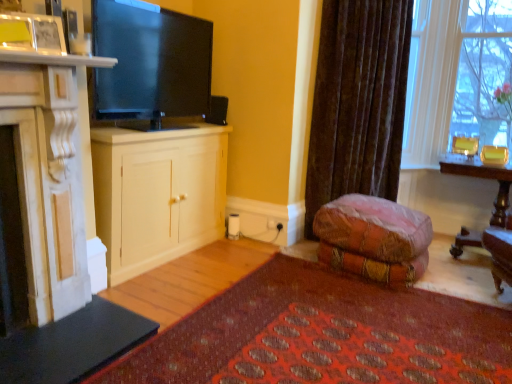
Question: From a real-world perspective, is velvet-like fabric couch at lower center beneath clear glass vase at upper right?

Choices:
 (A) no
 (B) yes

Answer: (B)

Question: Would you consider velvet-like fabric couch at lower center to be distant from clear glass vase at upper right?

Choices:
 (A) no
 (B) yes

Answer: (B)

Question: From a real-world perspective, is velvet-like fabric couch at lower center physically above clear glass vase at upper right?

Choices:
 (A) yes
 (B) no

Answer: (B)

Question: Can you confirm if velvet-like fabric couch at lower center is taller than clear glass vase at upper right?

Choices:
 (A) no
 (B) yes

Answer: (A)

Question: Would you say clear glass vase at upper right is part of velvet-like fabric couch at lower center's contents?

Choices:
 (A) no
 (B) yes

Answer: (A)

Question: Is velvet-like fabric couch at lower center facing towards clear glass vase at upper right?

Choices:
 (A) yes
 (B) no

Answer: (B)

Question: Is white marble fireplace at left, which is counted as the second cabinetry, starting from the back, shorter than clear glass vase at upper right?

Choices:
 (A) yes
 (B) no

Answer: (A)

Question: From the image's perspective, is white marble fireplace at left, marked as the first cabinetry in a front-to-back arrangement, over clear glass vase at upper right?

Choices:
 (A) yes
 (B) no

Answer: (B)

Question: Does white marble fireplace at left, marked as the first cabinetry in a front-to-back arrangement, contain clear glass vase at upper right?

Choices:
 (A) no
 (B) yes

Answer: (A)

Question: Considering the relative positions of white marble fireplace at left, which is counted as the second cabinetry, starting from the back, and clear glass vase at upper right in the image provided, is white marble fireplace at left, which is counted as the second cabinetry, starting from the back, to the left of clear glass vase at upper right from the viewer's perspective?

Choices:
 (A) no
 (B) yes

Answer: (B)

Question: Is white marble fireplace at left, marked as the first cabinetry in a front-to-back arrangement, located outside clear glass vase at upper right?

Choices:
 (A) yes
 (B) no

Answer: (A)

Question: Does white marble fireplace at left, marked as the first cabinetry in a front-to-back arrangement, appear on the right side of clear glass vase at upper right?

Choices:
 (A) no
 (B) yes

Answer: (A)

Question: From the image's perspective, is white wood cabinet at center, which is counted as the second cabinetry, starting from the front, located above velvet brown curtain at center?

Choices:
 (A) yes
 (B) no

Answer: (B)